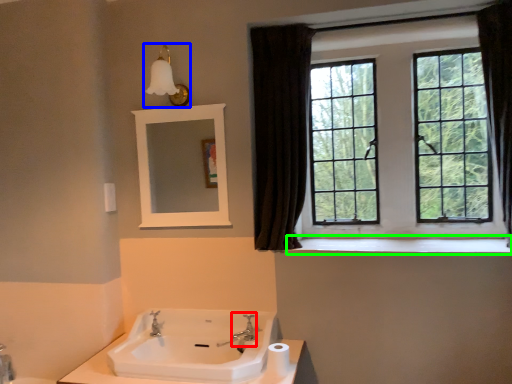
Question: Based on their relative distances, which object is farther from plumbing fixture (highlighted by a red box)? Choose from light fixture (highlighted by a blue box) and window sill (highlighted by a green box).

Choices:
 (A) light fixture
 (B) window sill

Answer: (A)